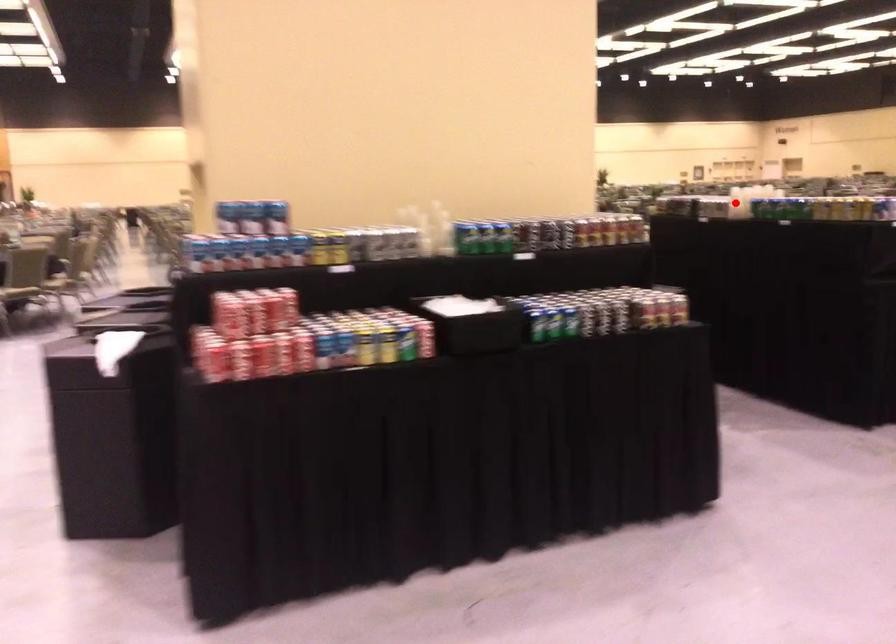
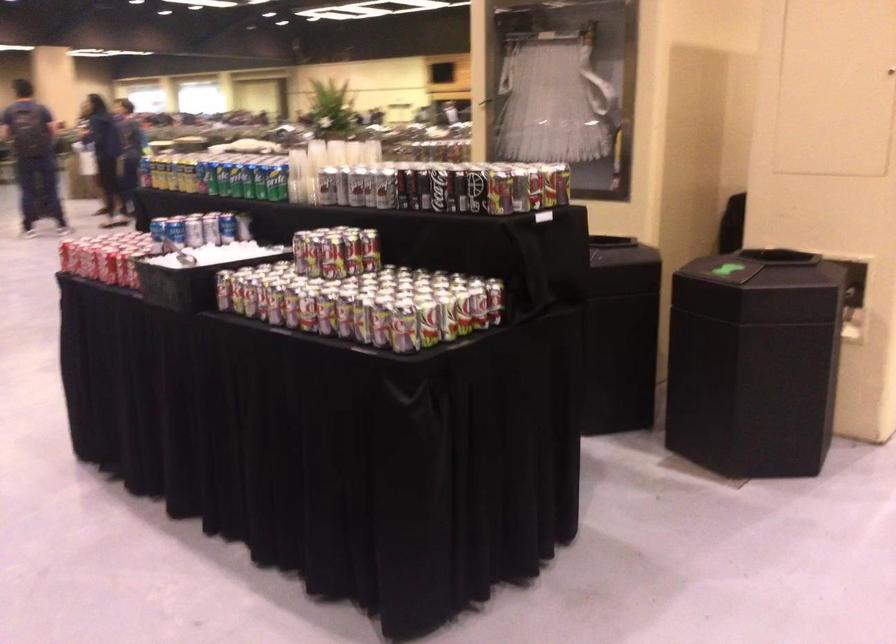
Question: I am providing you with two images of the same scene from different viewpoints. A red point is marked on the first image. Can you still see the location of the red point in image 2?

Choices:
 (A) Yes
 (B) No

Answer: (B)